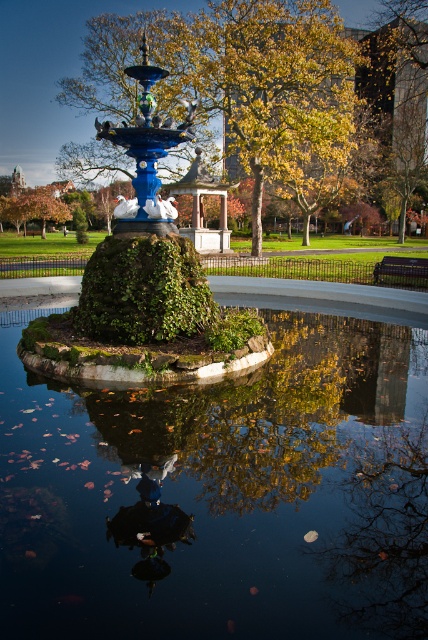
Does transparent glass water at center come in front of green leafy tree at center?

That is True.

Does transparent glass water at center have a lesser width compared to green leafy tree at center?

Yes, transparent glass water at center is thinner than green leafy tree at center.

Identify the location of transparent glass water at center. (222, 493).

Is point (113, 29) farther from viewer compared to point (149, 257)?

Yes.

Based on the photo, is green leafy tree at center below green mossy hedge at center?

No.

Is point (246, 80) less distant than point (116, 305)?

No, it is not.

Identify the location of green leafy tree at center. (237, 77).

Does blue glossy fountain at center have a greater width compared to green mossy hedge at center?

Yes.

Is point (124, 324) positioned behind point (202, 310)?

No, it is not.

Image resolution: width=428 pixels, height=640 pixels. What do you see at coordinates (142, 284) in the screenshot?
I see `blue glossy fountain at center` at bounding box center [142, 284].

The height and width of the screenshot is (640, 428). I want to click on blue glossy fountain at center, so click(x=142, y=284).